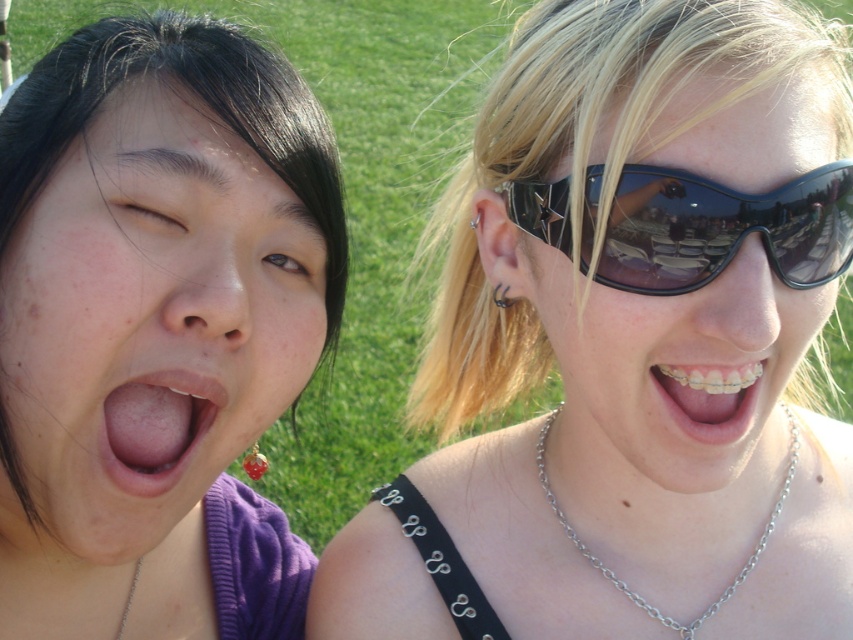
You are taking a photo of the two people in the image. The camera you are using has a minimum focus distance of 30 inches. Will the point at coordinates point [207,420] be in focus?

The point at coordinates point [207,420] is 30.94 inches from the camera, which is just above the minimum focus distance of 30 inches. Therefore, the point will be in focus.

Based on the coordinates provided, what feature is located at point (155, 428) in the image?

The point (155, 428) indicates pink smooth lips at lower left.